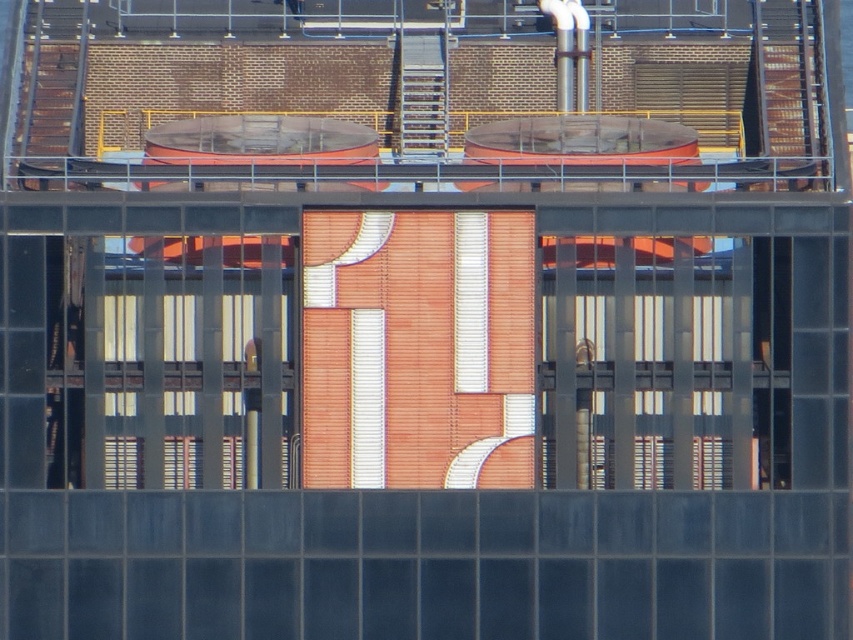
Consider the image. You are standing in a room with a transparent glass window at center. You want to place a small plant exactly at point (663, 362). Can you place it there?

The transparent glass window at center is located at point (663, 362), so you cannot place the plant there as it is occupied by the window.